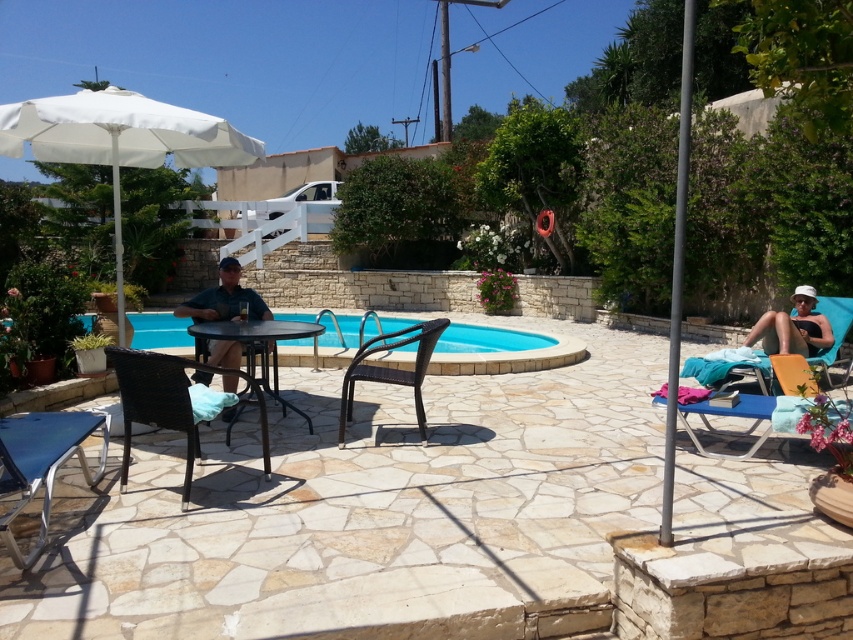
Question: Does blue glossy pool at center have a greater width compared to blue fabric chair at lower left?

Choices:
 (A) yes
 (B) no

Answer: (A)

Question: Can you confirm if metallic wicker table at center is positioned above beige fabric towel at lower right?

Choices:
 (A) yes
 (B) no

Answer: (B)

Question: Which point is closer to the camera?

Choices:
 (A) (9, 460)
 (B) (798, 349)
 (C) (181, 506)
 (D) (483, 346)

Answer: (A)

Question: Where is woven brown chair at lower left located in relation to brown woven chair at center in the image?

Choices:
 (A) right
 (B) left

Answer: (B)

Question: Which point is farther from the camera taking this photo?

Choices:
 (A) (242, 348)
 (B) (219, 296)
 (C) (810, 333)
 (D) (425, 355)

Answer: (C)

Question: Considering the real-world distances, which object is farthest from the metallic wicker table at center?

Choices:
 (A) blue glossy pool at center
 (B) blue fabric chair at lower left
 (C) white fabric umbrella at upper left
 (D) beige fabric towel at lower right

Answer: (D)